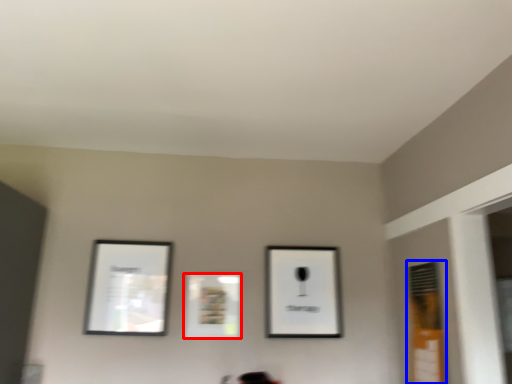
Question: Which of the following is the closest to the observer, picture frame (highlighted by a red box) or window (highlighted by a blue box)?

Choices:
 (A) picture frame
 (B) window

Answer: (B)